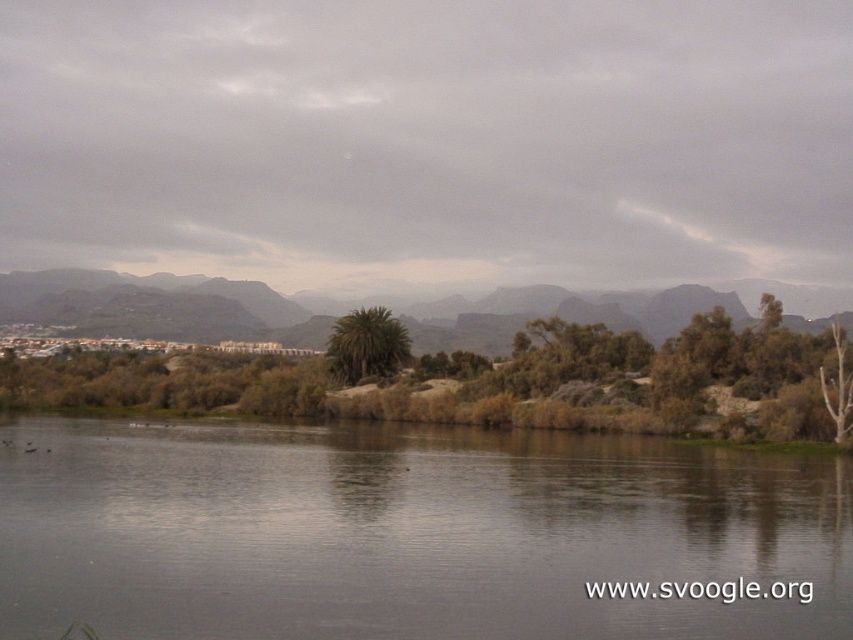
Question: Is green leafy vegetation at lower center to the left of green leafy palm tree at center from the viewer's perspective?

Choices:
 (A) yes
 (B) no

Answer: (A)

Question: Can you confirm if gray reflective water at center is positioned above green leafy vegetation at lower center?

Choices:
 (A) yes
 (B) no

Answer: (B)

Question: Estimate the real-world distances between objects in this image. Which object is closer to the green leafy tree at center?

Choices:
 (A) green leafy vegetation at lower center
 (B) gray reflective water at center

Answer: (A)

Question: Among these points, which one is farthest from the camera?

Choices:
 (A) (392, 337)
 (B) (163, 548)
 (C) (605, 369)
 (D) (222, 298)

Answer: (D)

Question: Can you confirm if green leafy tree at center is positioned below green leafy vegetation at lower center?

Choices:
 (A) yes
 (B) no

Answer: (A)

Question: Estimate the real-world distances between objects in this image. Which object is farther from the gray reflective water at center?

Choices:
 (A) green leafy tree at center
 (B) green leafy palm tree at center
 (C) green leafy vegetation at lower center

Answer: (C)